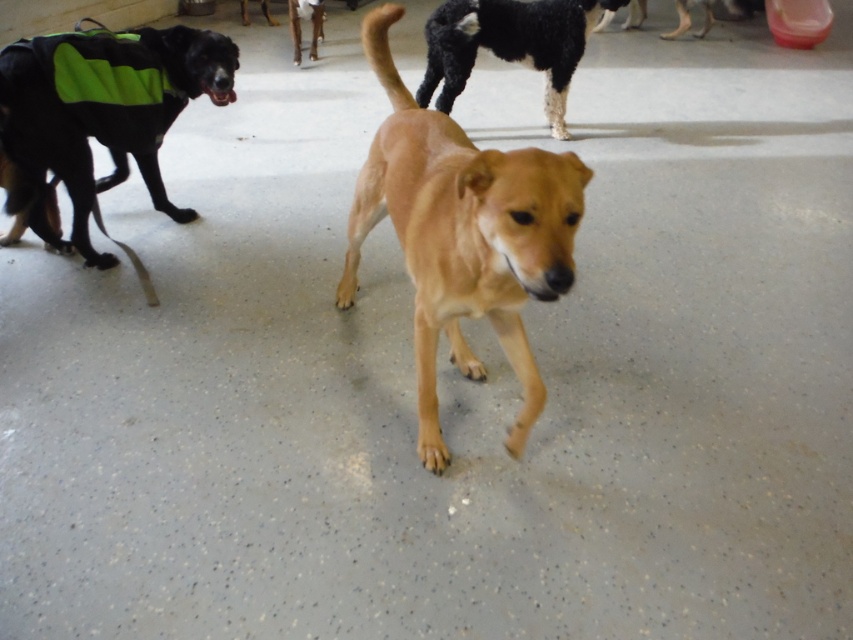
You are standing at the entrance of the shelter and want to find the golden fur dog at center. According to the coordinates provided, where should you look relative to your position?

The golden fur dog at center is located at coordinates point (462,236), which means it is positioned slightly to the lower right from your central view. Since the coordinates are normalized, 0.0 represents the bottom left corner and 1.0 the top right corner, so you should look towards the lower right direction from your current position to find it.

In the scene shown: You are a volunteer at the shelter and need to locate the green reflective vest at left. According to the spatial coordinates provided, where exactly should you look in the image to find it?

The green reflective vest at left is located at point 0.173 on the horizontal axis and 0.121 on the vertical axis.

You are a visitor at the shelter and want to find the golden fur dog at center. The staff tells you that it is located under the green reflective vest at left. Can you confirm if this is possible based on their positions?

The golden fur dog at center is positioned under the green reflective vest at left, so yes, the staff is correct because the golden fur dog at center is directly below the green reflective vest at left.